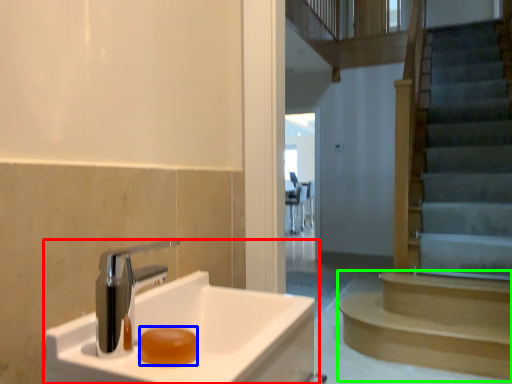
Question: Estimate the real-world distances between objects in this image. Which object is closer to sink (highlighted by a red box), soap (highlighted by a blue box) or stairs (highlighted by a green box)?

Choices:
 (A) soap
 (B) stairs

Answer: (A)